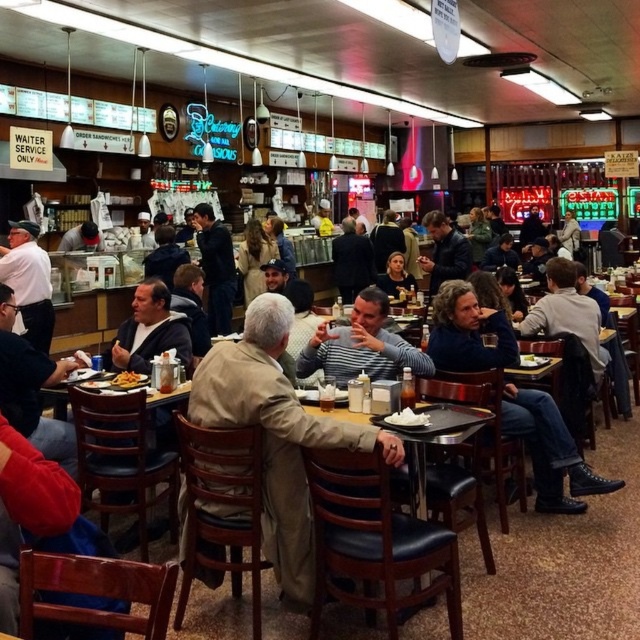
You are a diner customer who wants to place a small salad bowl on the table. The salad bowl is the same size as the white matte plate at center. Is there enough space on the table to place the salad bowl next to the golden crispy fries at center without overlapping?

The white matte plate at center occupies less space than golden crispy fries at center. Since the salad bowl is the same size as the white matte plate at center, it would be smaller than the golden crispy fries at center. However, the golden crispy fries at center already occupy more space than the salad bowl. Therefore, there might still be enough space on the table to place the salad bowl next to the golden crispy fries at center without overlapping, but it depends on the total table size and other items.

You are a diner customer who just sat down at the table. You see a black plastic tray at center and a khaki cotton jacket at center. Which item is closer to you?

The black plastic tray at center is closer to you than the khaki cotton jacket at center.